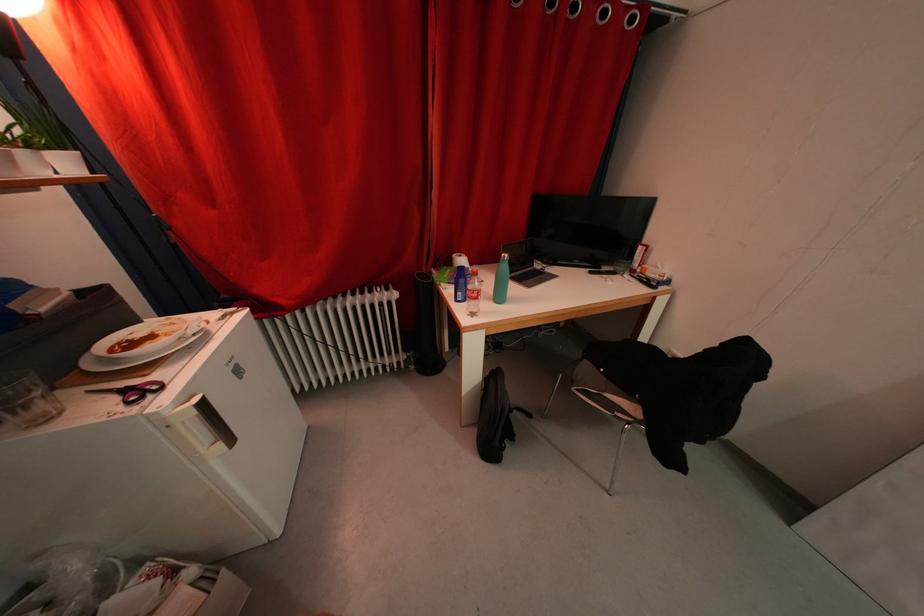
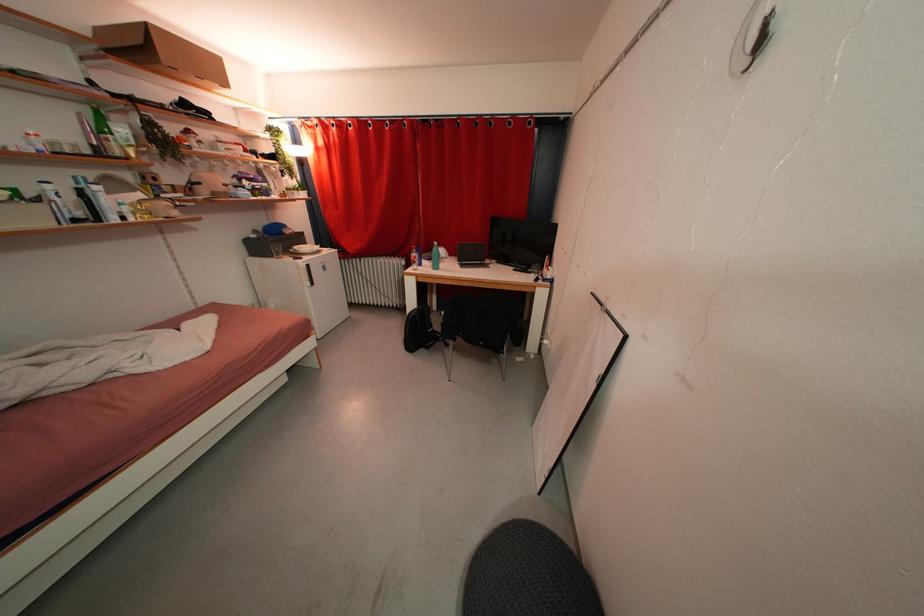
Locate, in the second image, the point that corresponds to point (517, 415) in the first image.

(444, 344)